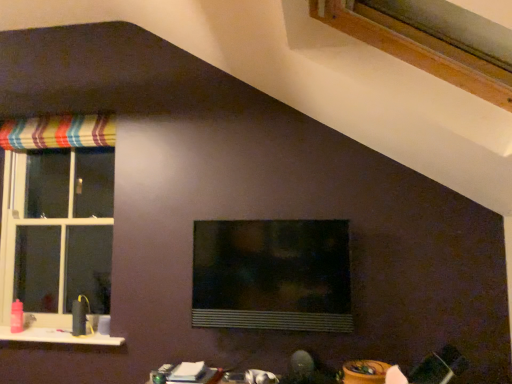
Find the location of a particular element. This screenshot has height=384, width=512. white glossy window sill at lower left is located at coordinates (57, 337).

This screenshot has height=384, width=512. What do you see at coordinates (59, 132) in the screenshot?
I see `striped fabric curtain at upper left` at bounding box center [59, 132].

Where is `white glossy table at lower center`? white glossy table at lower center is located at coordinates point(186,374).

What do you see at coordinates (186, 374) in the screenshot?
I see `white glossy table at lower center` at bounding box center [186, 374].

The width and height of the screenshot is (512, 384). In order to click on white plastic window at left, which ranks as the third window in right-to-left order in this screenshot , I will do `click(57, 217)`.

Is white glossy table at lower center further to the viewer compared to striped fabric curtain at upper left?

No, the depth of white glossy table at lower center is less than that of striped fabric curtain at upper left.

Locate an element on the screen. table located below the striped fabric curtain at upper left (from the image's perspective) is located at coordinates (186, 374).

From the image's perspective, is white glossy table at lower center located beneath striped fabric curtain at upper left?

Yes, from the image's perspective, white glossy table at lower center is beneath striped fabric curtain at upper left.

Considering the relative sizes of white glossy table at lower center and striped fabric curtain at upper left in the image provided, is white glossy table at lower center wider than striped fabric curtain at upper left?

Indeed, white glossy table at lower center has a greater width compared to striped fabric curtain at upper left.

Can you confirm if white glossy window sill at lower left is wider than transparent glass window at center, the 2th window positioned from the right?

Yes.

Is white glossy window sill at lower left to the left of transparent glass window at center, which is the 2th window in front-to-back order, from the viewer's perspective?

Correct, you'll find white glossy window sill at lower left to the left of transparent glass window at center, which is the 2th window in front-to-back order.

Is point (67, 343) in front of point (332, 328)?

No, (67, 343) is further to viewer.

From a real-world perspective, is white glossy window sill at lower left on top of transparent glass window at center, which is the 2th window in front-to-back order?

No.

Which object is more forward, striped fabric curtain at upper left or white glossy table at lower center?

white glossy table at lower center is in front.

Is striped fabric curtain at upper left wider or thinner than white glossy table at lower center?

Considering their sizes, striped fabric curtain at upper left looks slimmer than white glossy table at lower center.

From a real-world perspective, is striped fabric curtain at upper left physically located above or below white glossy table at lower center?

In terms of real-world spatial position, striped fabric curtain at upper left is above white glossy table at lower center.

Is wooden frame at upper right, the third window positioned from the left, facing towards white plastic window at left, the third window from the front?

No.

From the image's perspective, who appears lower, wooden frame at upper right, the third window positioned from the left, or white plastic window at left, marked as the first window in a back-to-front arrangement?

white plastic window at left, marked as the first window in a back-to-front arrangement, is shown below in the image.

Does wooden frame at upper right, placed as the first window when sorted from front to back, appear on the left side of white plastic window at left, which ranks as the third window in right-to-left order?

In fact, wooden frame at upper right, placed as the first window when sorted from front to back, is to the right of white plastic window at left, which ranks as the third window in right-to-left order.

Is striped fabric curtain at upper left behind wooden frame at upper right, the third window positioned from the left?

That is True.

Considering the sizes of objects striped fabric curtain at upper left and wooden frame at upper right, the third window positioned from the left, in the image provided, who is thinner, striped fabric curtain at upper left or wooden frame at upper right, the third window positioned from the left,?

With smaller width is striped fabric curtain at upper left.

Image resolution: width=512 pixels, height=384 pixels. In order to click on curtain behind the wooden frame at upper right, placed as the first window when sorted from front to back in this screenshot , I will do `click(59, 132)`.

Does point (36, 138) appear closer or farther from the camera than point (493, 98)?

Point (36, 138) appears to be farther away from the viewer than point (493, 98).

Is striped fabric curtain at upper left far away from white glossy window sill at lower left?

Absolutely, striped fabric curtain at upper left is distant from white glossy window sill at lower left.

Is white glossy window sill at lower left inside striped fabric curtain at upper left?

Definitely not — white glossy window sill at lower left is not inside striped fabric curtain at upper left.

Considering the positions of point (3, 123) and point (22, 341), is point (3, 123) closer or farther from the camera than point (22, 341)?

Point (3, 123) is farther from the camera than point (22, 341).

From a real-world perspective, which is physically below, striped fabric curtain at upper left or white glossy window sill at lower left?

white glossy window sill at lower left.

Does white glossy window sill at lower left have a smaller size compared to white glossy table at lower center?

No, white glossy window sill at lower left is not smaller than white glossy table at lower center.

Is white glossy window sill at lower left to the left or to the right of white glossy table at lower center in the image?

Clearly, white glossy window sill at lower left is on the left of white glossy table at lower center in the image.

Is white glossy window sill at lower left aimed at white glossy table at lower center?

No, white glossy window sill at lower left is not turned towards white glossy table at lower center.

From a real-world perspective, is white glossy window sill at lower left over white glossy table at lower center?

Yes, from a real-world perspective, white glossy window sill at lower left is over white glossy table at lower center

This screenshot has height=384, width=512. In the image, there is a striped fabric curtain at upper left. What are the coordinates of `table below it (from the image's perspective)` in the screenshot? It's located at (186, 374).

Starting from the white glossy window sill at lower left, which window is the 1st one to the right? Please provide its 2D coordinates.

[(272, 275)]

Looking at the image, which one is located closer to white glossy window sill at lower left, transparent glass window at center, the 2th window positioned from the right, or white plastic window at left, marked as the first window in a back-to-front arrangement?

white plastic window at left, marked as the first window in a back-to-front arrangement.

Based on their spatial positions, is transparent glass window at center, placed as the second window when sorted from back to front, or white glossy table at lower center further from white glossy window sill at lower left?

The object further to white glossy window sill at lower left is transparent glass window at center, placed as the second window when sorted from back to front.

Based on their spatial positions, is striped fabric curtain at upper left or transparent glass window at center, placed as the second window when sorted from back to front, closer to white glossy window sill at lower left?

transparent glass window at center, placed as the second window when sorted from back to front, is positioned closer to the anchor white glossy window sill at lower left.

Looking at the image, which one is located closer to transparent glass window at center, placed as the second window when sorted from back to front, white glossy window sill at lower left or white glossy table at lower center?

Among the two, white glossy table at lower center is located nearer to transparent glass window at center, placed as the second window when sorted from back to front.

Which object lies nearer to the anchor point striped fabric curtain at upper left, white glossy table at lower center or transparent glass window at center, which is the 2th window in front-to-back order?

transparent glass window at center, which is the 2th window in front-to-back order, lies closer to striped fabric curtain at upper left than the other object.

From the image, which object appears to be farther from striped fabric curtain at upper left, wooden frame at upper right, the third window positioned from the left, or white glossy window sill at lower left?

wooden frame at upper right, the third window positioned from the left, lies further to striped fabric curtain at upper left than the other object.

From the image, which object appears to be nearer to white glossy table at lower center, white plastic window at left, which ranks as the third window in right-to-left order, or striped fabric curtain at upper left?

Based on the image, white plastic window at left, which ranks as the third window in right-to-left order, appears to be nearer to white glossy table at lower center.

Which object lies further to the anchor point transparent glass window at center, the 2th window positioned from the right, striped fabric curtain at upper left or white plastic window at left, arranged as the 1th window when viewed from the left?

The object further to transparent glass window at center, the 2th window positioned from the right, is striped fabric curtain at upper left.

Find the location of a particular element. table between white glossy window sill at lower left and wooden frame at upper right, acting as the 3th window starting from the back is located at coordinates (186, 374).

The image size is (512, 384). Identify the location of window sill between striped fabric curtain at upper left and wooden frame at upper right, acting as the 3th window starting from the back, in the horizontal direction. (57, 337).

Locate an element on the screen. The height and width of the screenshot is (384, 512). window between white plastic window at left, marked as the first window in a back-to-front arrangement, and wooden frame at upper right, acting as the 3th window starting from the back, in the horizontal direction is located at coordinates (272, 275).

This screenshot has width=512, height=384. I want to click on window sill between white plastic window at left, marked as the first window in a back-to-front arrangement, and white glossy table at lower center from left to right, so click(x=57, y=337).